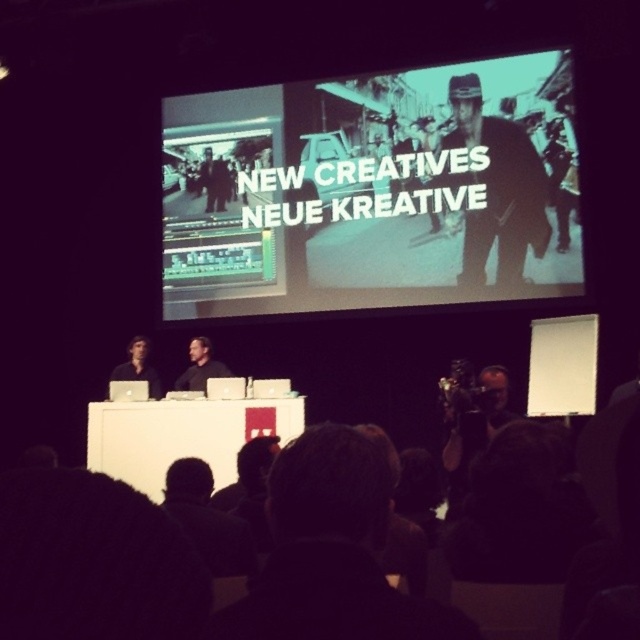
Does point (278, 182) lie behind point (468, 272)?

Yes, point (278, 182) is behind point (468, 272).

The image size is (640, 640). What do you see at coordinates (372, 189) in the screenshot? I see `teal matte projection screen at center` at bounding box center [372, 189].

Who is more forward, (470, 221) or (536, 161)?

Point (536, 161) is in front.

Locate an element on the screen. teal matte projection screen at center is located at coordinates (372, 189).

Between point (499, 237) and point (209, 358), which one is positioned behind?

The point (209, 358) is behind.

Measure the distance from dark textured jacket at upper right to black shirt at center.

dark textured jacket at upper right is 43.04 feet away from black shirt at center.

Which is behind, point (490, 144) or point (204, 378)?

Positioned behind is point (204, 378).

Image resolution: width=640 pixels, height=640 pixels. I want to click on dark textured jacket at upper right, so click(x=497, y=188).

Is teal matte projection screen at center closer to the viewer compared to black shirt at center?

Yes, it is.

Who is taller, teal matte projection screen at center or black shirt at center?

teal matte projection screen at center is taller.

Between point (266, 260) and point (186, 378), which one is positioned in front?

Point (266, 260) is in front.

Where is `teal matte projection screen at center`? teal matte projection screen at center is located at coordinates point(372,189).